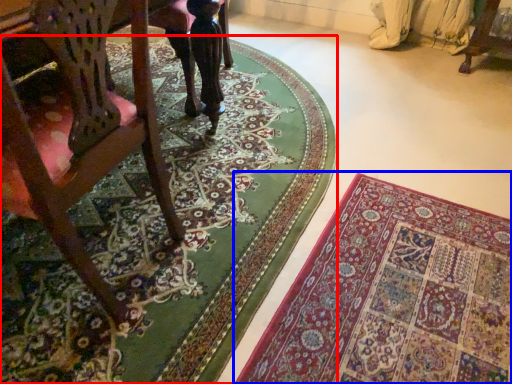
Question: Which of the following is the closest to the observer, mat (highlighted by a red box) or mat (highlighted by a blue box)?

Choices:
 (A) mat
 (B) mat

Answer: (B)